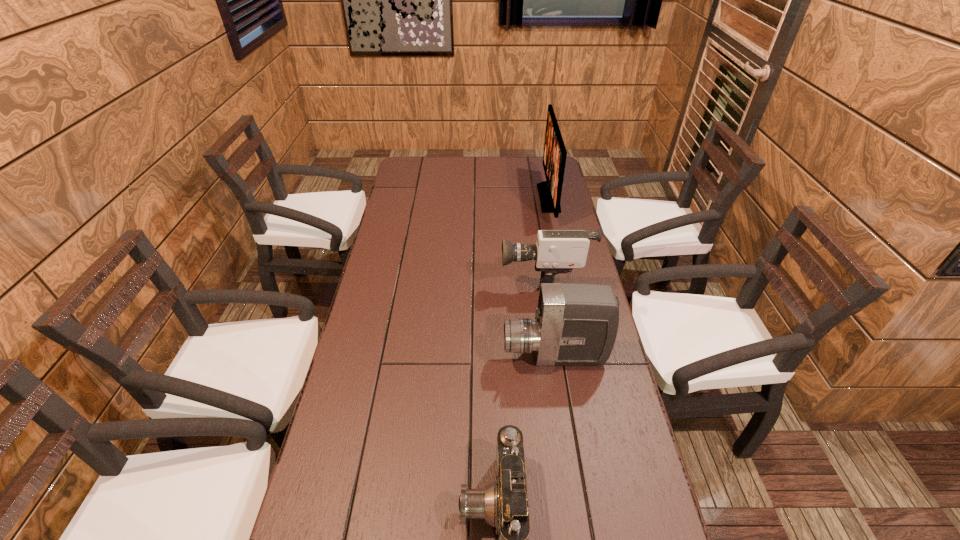
In order to click on vacant space situated 0.120m on the recording direction of the farthest camcorder in this screenshot , I will do `click(465, 276)`.

Locate an element on the screen. The image size is (960, 540). vacant space positioned 0.180m on the recording direction of the farthest camcorder is located at coordinates (446, 276).

I want to click on blank space located 0.390m on the recording direction of the farthest camcorder, so click(384, 276).

Identify the location of object at the far edge. The width and height of the screenshot is (960, 540). (554, 157).

At what (x,y) coordinates should I click in order to perform the action: click on monitor located at the right edge. Please return your answer as a coordinate pair (x, y). The image size is (960, 540). Looking at the image, I should click on (554, 157).

Locate an element on the screen. The height and width of the screenshot is (540, 960). object present at the far right corner is located at coordinates (554, 157).

Find the location of a particular element. vacant area at the far edge is located at coordinates (500, 157).

You are a GUI agent. You are given a task and a screenshot of the screen. Output one action in this format:
    pyautogui.click(x=<x>, y=<y>)
    Task: Click on the vacant space at the left edge of the desktop
    
    Given the screenshot: What is the action you would take?
    400,333

Identify the location of free space at the right edge. Image resolution: width=960 pixels, height=540 pixels. (536, 213).

In the image, there is a desktop. Where is `vacant space at the far left corner`? The height and width of the screenshot is (540, 960). vacant space at the far left corner is located at coordinates (432, 176).